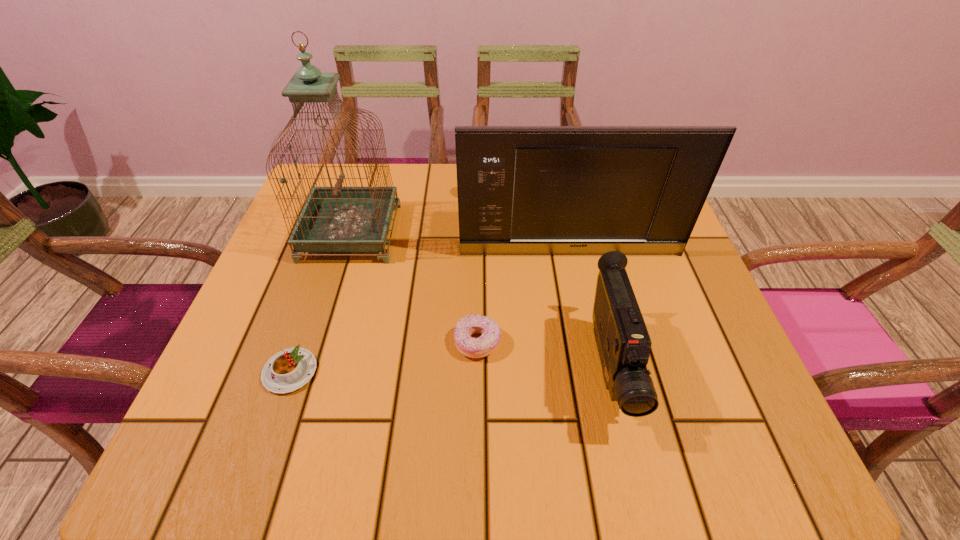
At what (x,y) coordinates should I click in order to perform the action: click on object located in the near edge section of the desktop. Please return your answer as a coordinate pair (x, y). Image resolution: width=960 pixels, height=540 pixels. Looking at the image, I should click on (623, 342).

Where is `birdcage that is positioned at the left edge`? birdcage that is positioned at the left edge is located at coordinates (334, 219).

Where is `pudding that is at the left edge`? This screenshot has width=960, height=540. pudding that is at the left edge is located at coordinates (290, 369).

Locate an element on the screen. object situated at the right edge is located at coordinates (542, 190).

Image resolution: width=960 pixels, height=540 pixels. Find the location of `object present at the far left corner`. object present at the far left corner is located at coordinates (334, 219).

Locate an element on the screen. Image resolution: width=960 pixels, height=540 pixels. free space at the far edge of the desktop is located at coordinates (377, 165).

You are a GUI agent. You are given a task and a screenshot of the screen. Output one action in this format:
    pyautogui.click(x=<x>, y=<y>)
    Task: Click on the vacant space at the near edge of the desktop
    The width and height of the screenshot is (960, 540).
    Given the screenshot: What is the action you would take?
    pyautogui.click(x=324, y=430)

Identify the location of free space at the left edge of the desktop. (271, 276).

Where is `vacant space at the right edge of the desktop`? The height and width of the screenshot is (540, 960). vacant space at the right edge of the desktop is located at coordinates (707, 352).

In the image, there is a desktop. Where is `free space at the far left corner`? The width and height of the screenshot is (960, 540). free space at the far left corner is located at coordinates (348, 168).